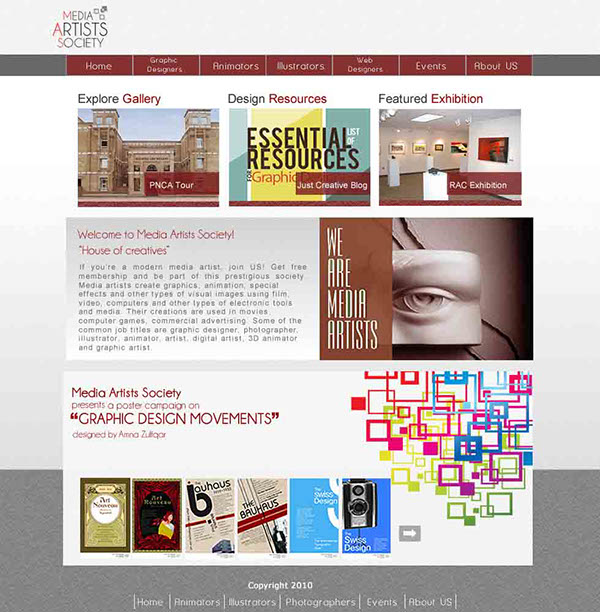
The width and height of the screenshot is (600, 612). I want to click on white pedestals, so click(431, 185), click(396, 172), click(432, 163), click(466, 166).